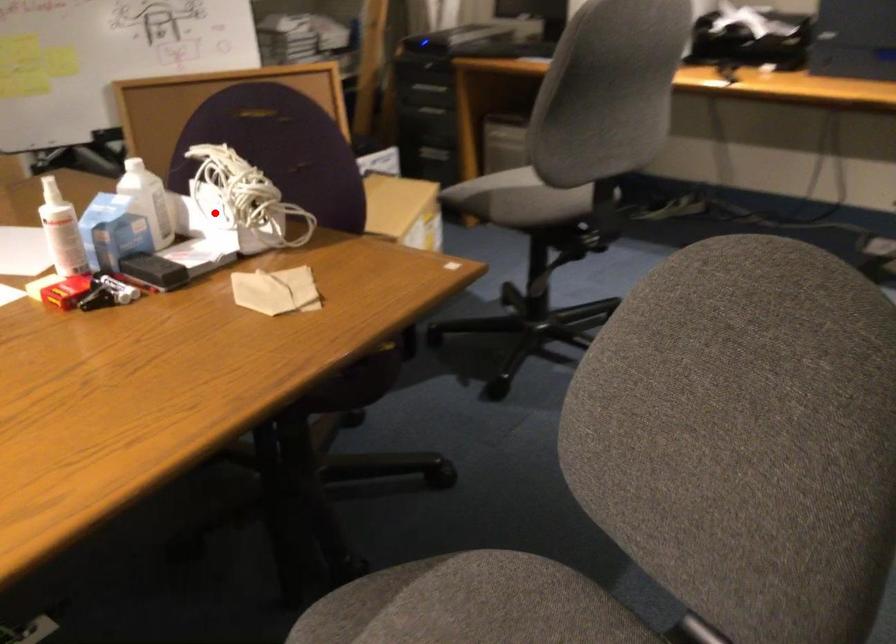
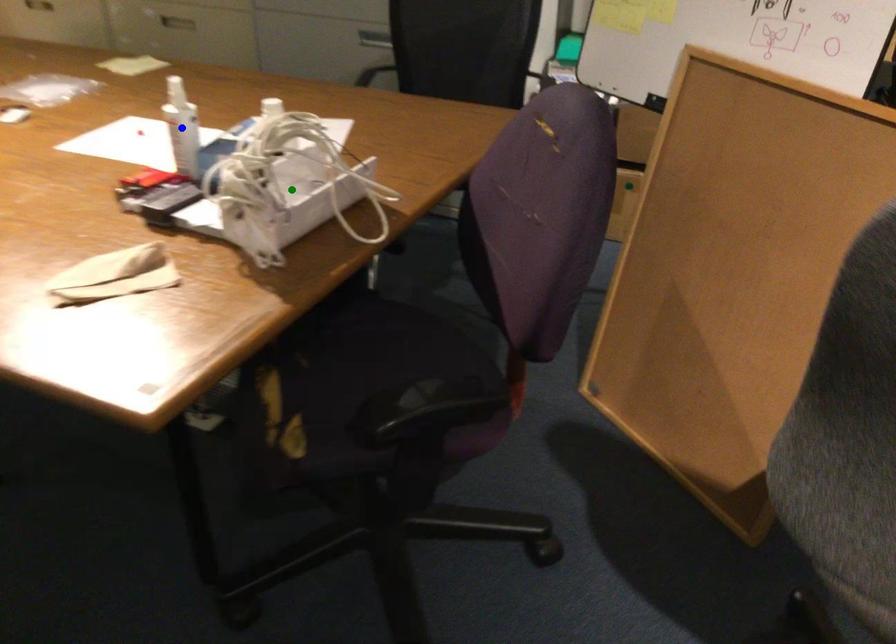
Question: I am providing you with two images of the same scene from different viewpoints. A red point is marked on the first image. You are given multiple points on the second image. Which mark in image 2 goes with the point in image 1?

Choices:
 (A) yellow point
 (B) blue point
 (C) green point

Answer: (C)